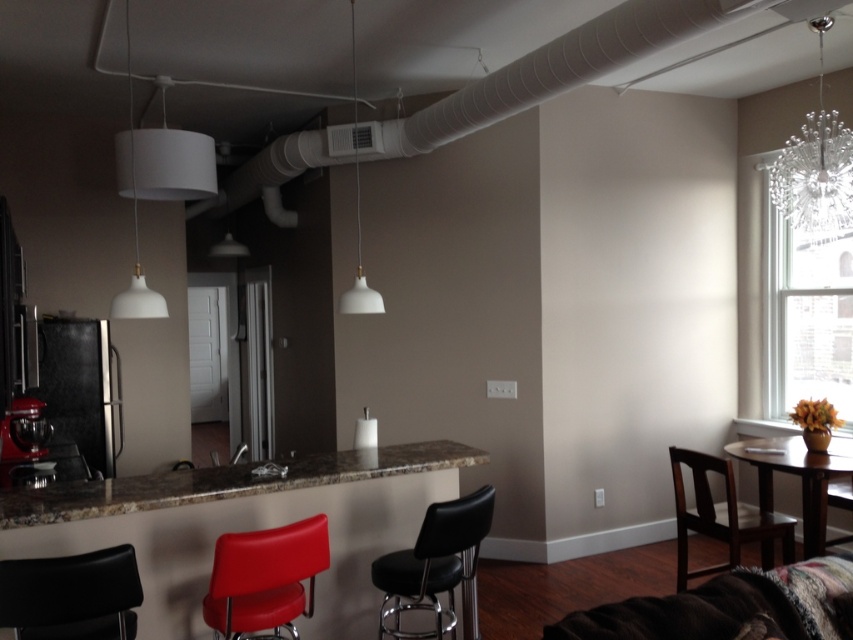
Question: Which point appears farthest from the camera in this image?

Choices:
 (A) (782, 184)
 (B) (814, 145)
 (C) (189, 148)

Answer: (A)

Question: Considering the relative positions of black leather bar stool at center and white matte lampshade at upper center in the image provided, where is black leather bar stool at center located with respect to white matte lampshade at upper center?

Choices:
 (A) right
 (B) left

Answer: (A)

Question: Considering the relative positions of brown wooden chair at lower right and white matte lampshade at upper center in the image provided, where is brown wooden chair at lower right located with respect to white matte lampshade at upper center?

Choices:
 (A) left
 (B) right

Answer: (B)

Question: Is black leather chair at lower left smaller than white matte pendant light at upper left?

Choices:
 (A) no
 (B) yes

Answer: (A)

Question: Which of the following is the closest to the observer?

Choices:
 (A) (357, 180)
 (B) (114, 154)

Answer: (B)

Question: Which point is closer to the camera?

Choices:
 (A) (843, 211)
 (B) (485, 509)
 (C) (137, 260)

Answer: (B)